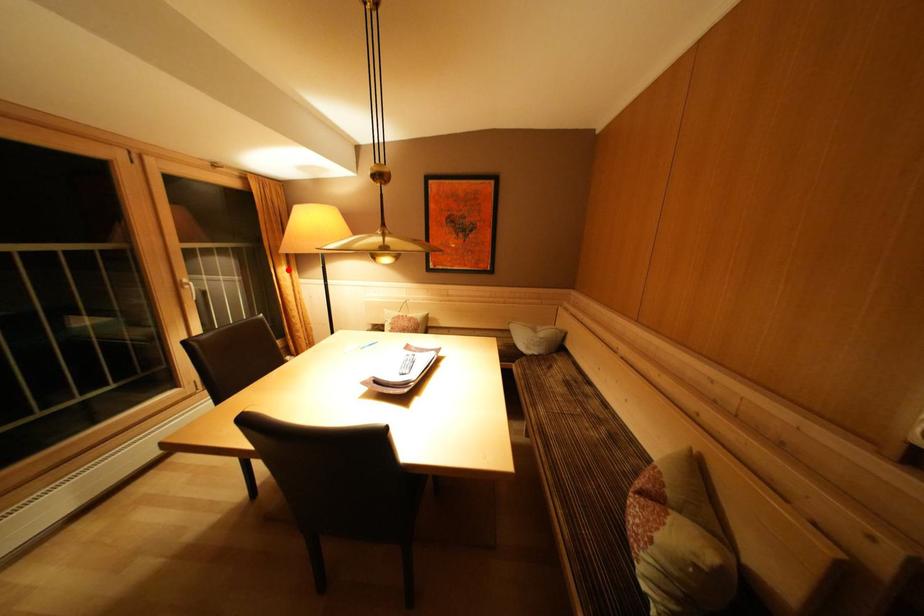
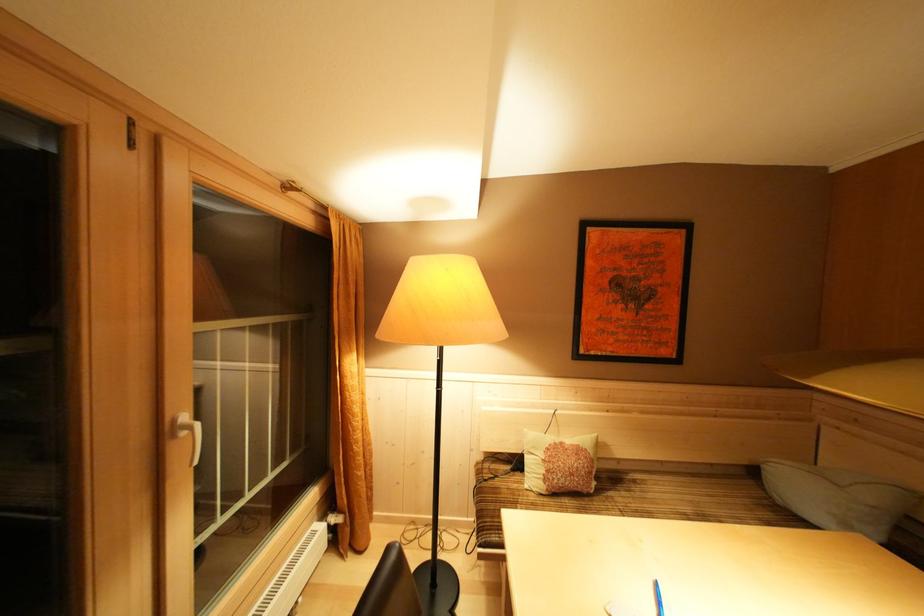
In the second image, find the point that corresponds to the highlighted location in the first image.

(358, 357)